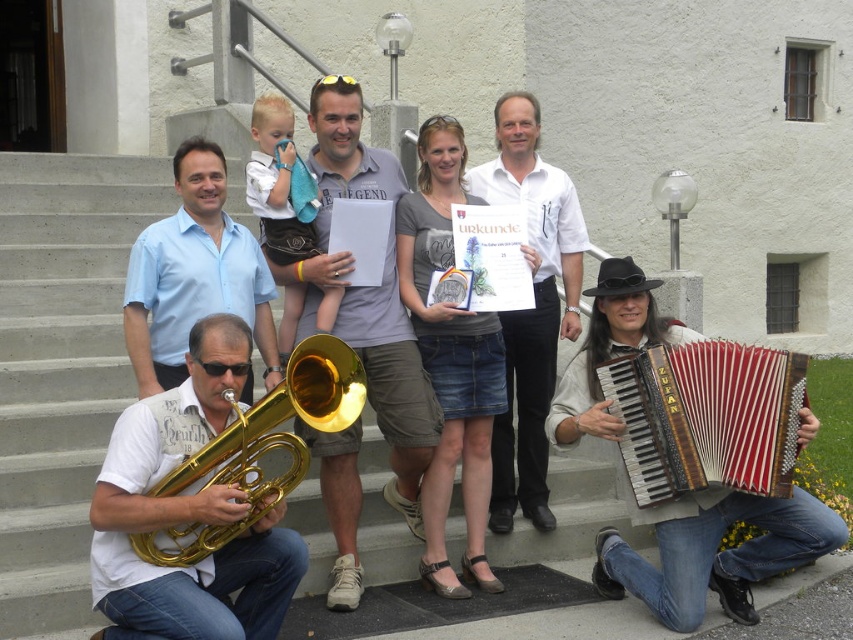
Is matte blue shirt at center shorter than gold brass tuba at lower left?

Incorrect, matte blue shirt at center's height does not fall short of gold brass tuba at lower left's.

At what (x,y) coordinates should I click in order to perform the action: click on matte blue shirt at center. Please return your answer as a coordinate pair (x, y). Looking at the image, I should click on (193, 275).

Does wooden/leather accordion at lower right have a larger size compared to white cotton shirt at center?

Incorrect, wooden/leather accordion at lower right is not larger than white cotton shirt at center.

The width and height of the screenshot is (853, 640). I want to click on wooden/leather accordion at lower right, so click(x=706, y=417).

This screenshot has width=853, height=640. I want to click on wooden/leather accordion at lower right, so click(x=706, y=417).

Is point (508, 426) closer to viewer compared to point (268, 333)?

No, (508, 426) is behind (268, 333).

Looking at this image, is white cotton shirt at center shorter than matte blue shirt at center?

No.

Who is more forward, (469, 182) or (247, 314)?

Point (247, 314) is in front.

Identify the location of white cotton shirt at center. (531, 308).